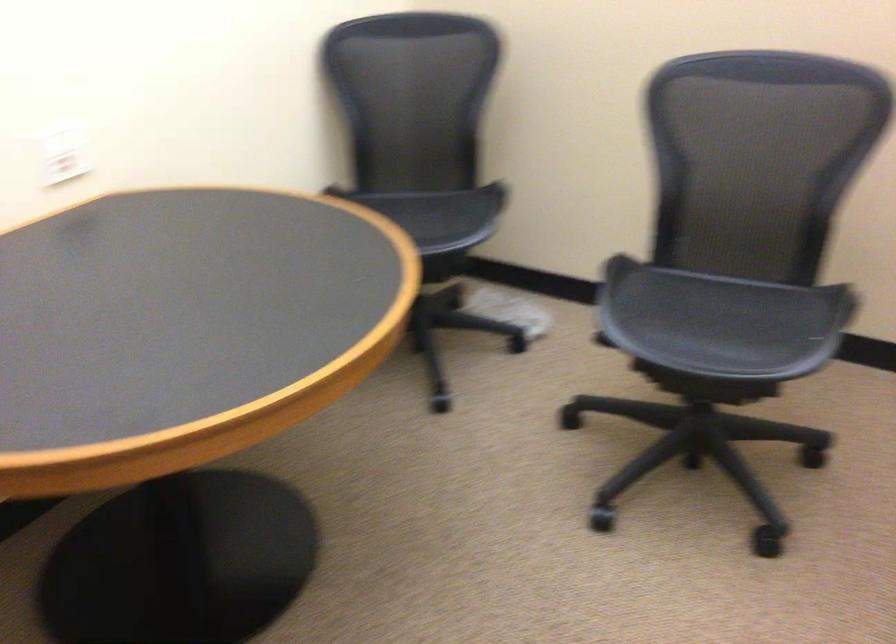
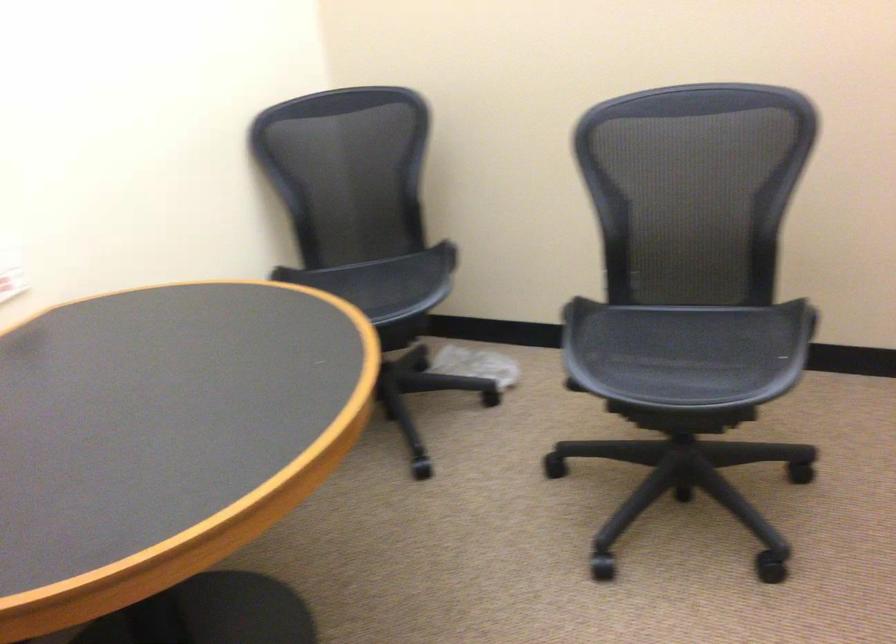
In the second image, find the point that corresponds to the point at 719,323 in the first image.

(686, 352)